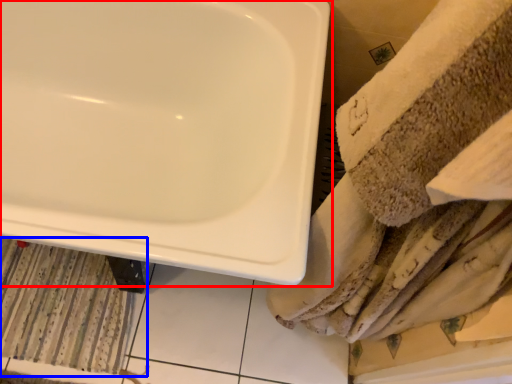
Question: Which object is further to the camera taking this photo, sink (highlighted by a red box) or bath mat (highlighted by a blue box)?

Choices:
 (A) sink
 (B) bath mat

Answer: (B)